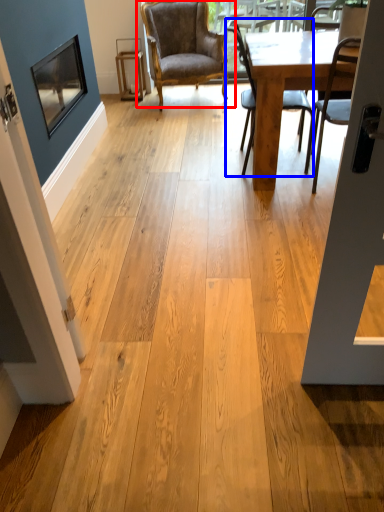
Question: Which of the following is the closest to the observer, chair (highlighted by a red box) or chair (highlighted by a blue box)?

Choices:
 (A) chair
 (B) chair

Answer: (B)